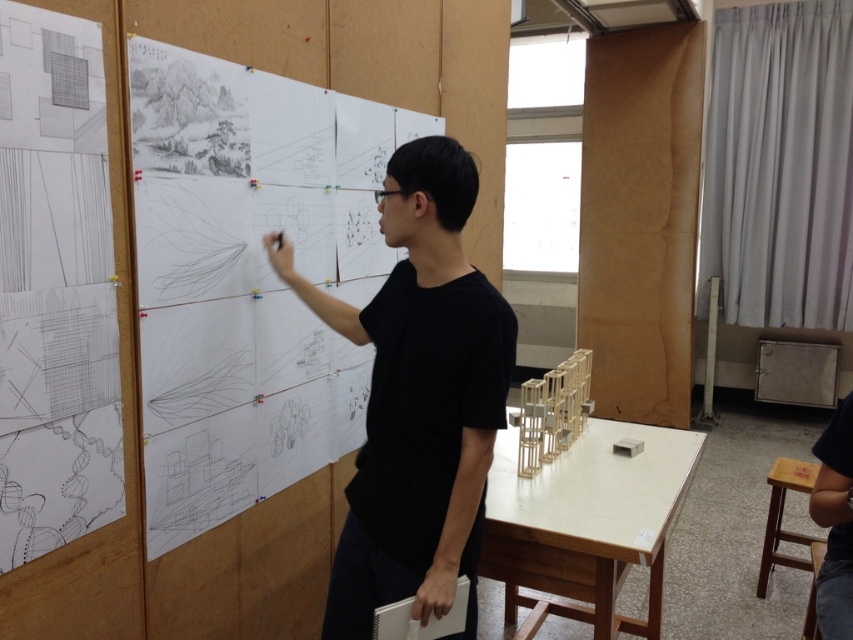
Question: Does black matte shirt at center have a smaller size compared to white matte table at center?

Choices:
 (A) yes
 (B) no

Answer: (B)

Question: Which object is positioned farthest from the white matte table at center?

Choices:
 (A) black matte shirt at center
 (B) wooden stool at lower right

Answer: (B)

Question: Which object is positioned farthest from the wooden stool at lower right?

Choices:
 (A) black matte shirt at center
 (B) white matte table at center

Answer: (A)

Question: Which object is closer to the camera taking this photo?

Choices:
 (A) wooden stool at lower right
 (B) black matte shirt at center
 (C) white matte table at center

Answer: (B)

Question: Is black matte shirt at center below wooden stool at lower right?

Choices:
 (A) yes
 (B) no

Answer: (B)

Question: Does black matte shirt at center have a smaller size compared to wooden stool at lower right?

Choices:
 (A) no
 (B) yes

Answer: (A)